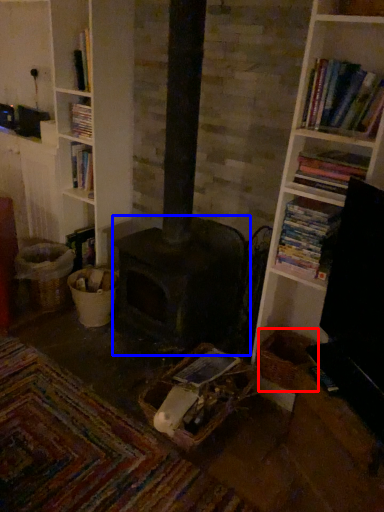
Question: Among these objects, which one is farthest to the camera, basket (highlighted by a red box) or heater (highlighted by a blue box)?

Choices:
 (A) basket
 (B) heater

Answer: (B)